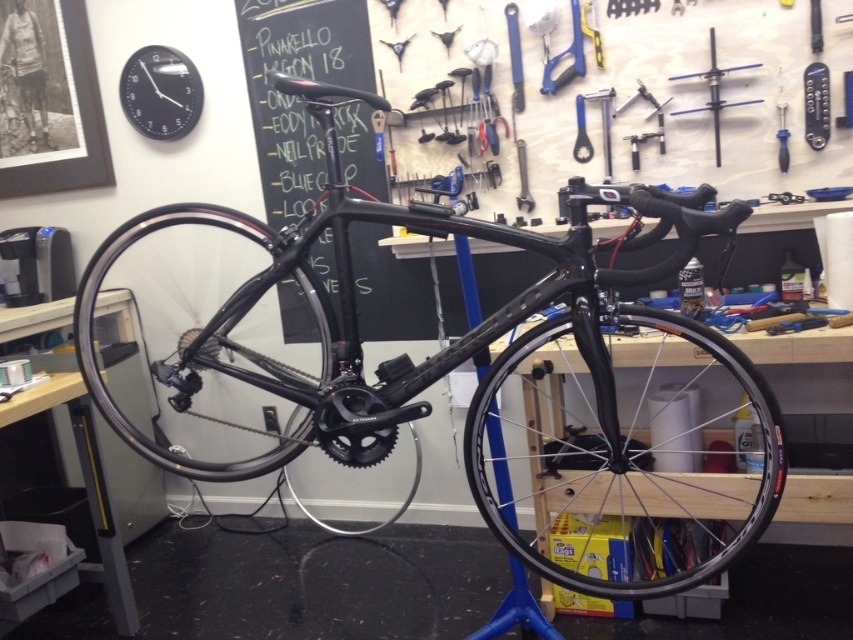
You are a customer in the bicycle repair workshop and want to point out two specific points in the scene. The first point is at coordinates point (555, 356) and the second point is at point (305, 131). Which of these two points is closer to you as you stand in the workshop?

Point (555, 356) is closer to the viewer than point (305, 131).

You are a mechanic in the workshop and need to reach for a screwdriver. You see the blue metallic screwdriver at upper center and the blue plastic screwdriver at upper right. Which one is located higher on the wall?

The blue metallic screwdriver at upper center is located higher on the wall than the blue plastic screwdriver at upper right.

You are a mechanic working in the bicycle repair workshop. You need to choose a screwdriver to tighten a bolt that requires a tool with a wider grip. Which of the two screwdrivers available, the blue metallic screwdriver at upper center or the blue plastic screwdriver at upper right, would be more suitable?

The blue metallic screwdriver at upper center has a greater width than the blue plastic screwdriver at upper right, making it more suitable for tightening a bolt that requires a wider grip.